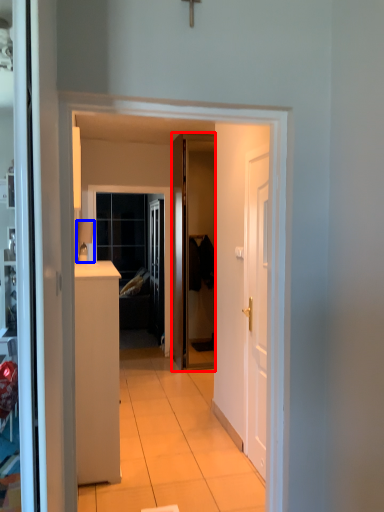
Question: Which object appears closest to the camera in this image, door (highlighted by a red box) or lamp (highlighted by a blue box)?

Choices:
 (A) door
 (B) lamp

Answer: (B)